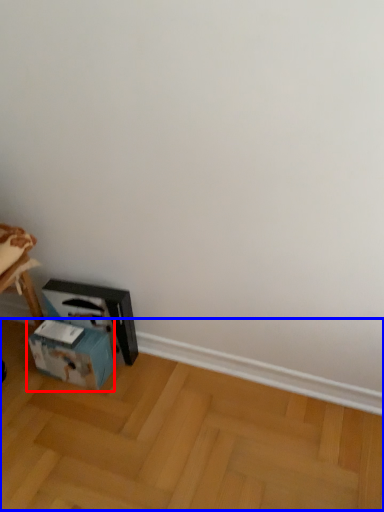
Question: Which object is further to the camera taking this photo, box (highlighted by a red box) or wood (highlighted by a blue box)?

Choices:
 (A) box
 (B) wood

Answer: (A)